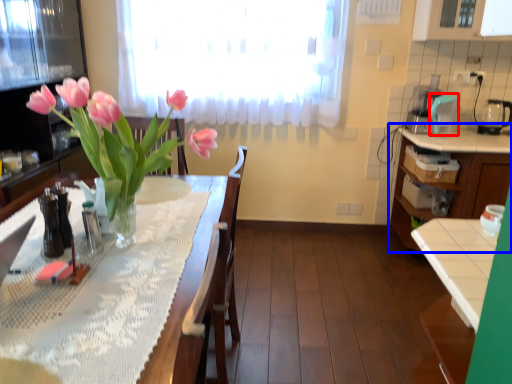
Question: Which object is closer to the camera taking this photo, appliance (highlighted by a red box) or cabinetry (highlighted by a blue box)?

Choices:
 (A) appliance
 (B) cabinetry

Answer: (B)